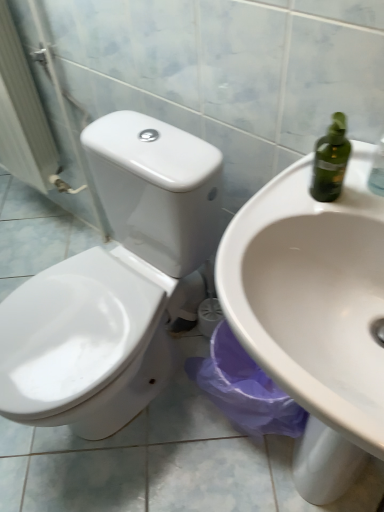
Question: Considering the relative sizes of white glossy toilet at center and white glossy toilet at left in the image provided, is white glossy toilet at center wider than white glossy toilet at left?

Choices:
 (A) yes
 (B) no

Answer: (A)

Question: Is the depth of white glossy toilet at center greater than that of white glossy toilet at left?

Choices:
 (A) no
 (B) yes

Answer: (A)

Question: From the image's perspective, is white glossy toilet at center on top of white glossy toilet at left?

Choices:
 (A) yes
 (B) no

Answer: (B)

Question: Is white glossy toilet at center oriented away from white glossy toilet at left?

Choices:
 (A) yes
 (B) no

Answer: (B)

Question: Is white glossy toilet at center not near white glossy toilet at left?

Choices:
 (A) no
 (B) yes

Answer: (A)

Question: Looking at their shapes, would you say white glossy toilet at center is wider or thinner than white glossy sink at center?

Choices:
 (A) thin
 (B) wide

Answer: (B)

Question: Considering the relative positions of white glossy toilet at center and white glossy sink at center in the image provided, is white glossy toilet at center to the left or to the right of white glossy sink at center?

Choices:
 (A) left
 (B) right

Answer: (A)

Question: From the image's perspective, is white glossy toilet at center located above or below white glossy sink at center?

Choices:
 (A) below
 (B) above

Answer: (B)

Question: In the image, is white glossy toilet at center positioned in front of or behind white glossy sink at center?

Choices:
 (A) front
 (B) behind

Answer: (B)

Question: From their relative heights in the image, would you say white glossy sink at center is taller or shorter than white glossy toilet at center?

Choices:
 (A) short
 (B) tall

Answer: (B)

Question: From the image's perspective, is white glossy sink at center located above or below white glossy toilet at center?

Choices:
 (A) below
 (B) above

Answer: (A)

Question: Would you say white glossy sink at center is inside or outside white glossy toilet at center?

Choices:
 (A) inside
 (B) outside

Answer: (B)

Question: From a real-world perspective, is white glossy sink at center above or below white glossy toilet at center?

Choices:
 (A) below
 (B) above

Answer: (B)

Question: Considering the positions of white glossy toilet at left and white glossy sink at center in the image, is white glossy toilet at left wider or thinner than white glossy sink at center?

Choices:
 (A) thin
 (B) wide

Answer: (A)

Question: From the image's perspective, is white glossy toilet at left above or below white glossy sink at center?

Choices:
 (A) below
 (B) above

Answer: (B)